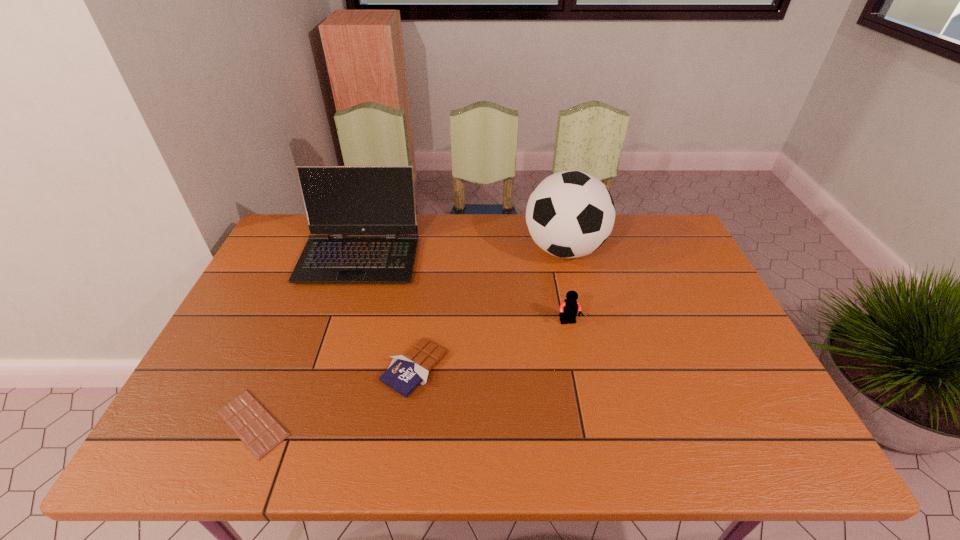
At what (x,y) coordinates should I click in order to perform the action: click on free region located on the front-facing side of the Lego. Please return your answer as a coordinate pair (x, y). Looking at the image, I should click on (583, 393).

Locate an element on the screen. The height and width of the screenshot is (540, 960). free spot located on the left of the right chocolate bar is located at coordinates (323, 368).

At what (x,y) coordinates should I click in order to perform the action: click on vacant space situated 0.190m on the right of the left chocolate bar. Please return your answer as a coordinate pair (x, y). This screenshot has height=540, width=960. Looking at the image, I should click on (380, 423).

Identify the location of soccer ball at the far edge. (570, 214).

At what (x,y) coordinates should I click in order to perform the action: click on laptop computer that is at the far edge. Please return your answer as a coordinate pair (x, y). This screenshot has height=540, width=960. Looking at the image, I should click on (339, 200).

Identify the location of object that is at the near edge. This screenshot has height=540, width=960. (257, 428).

This screenshot has height=540, width=960. I want to click on laptop computer that is at the left edge, so click(339, 200).

The image size is (960, 540). What are the coordinates of `chocolate bar located at the left edge` in the screenshot? It's located at (257, 428).

Where is `object located at the far left corner`? The image size is (960, 540). object located at the far left corner is located at coordinates click(339, 200).

Image resolution: width=960 pixels, height=540 pixels. I want to click on object that is positioned at the near left corner, so click(257, 428).